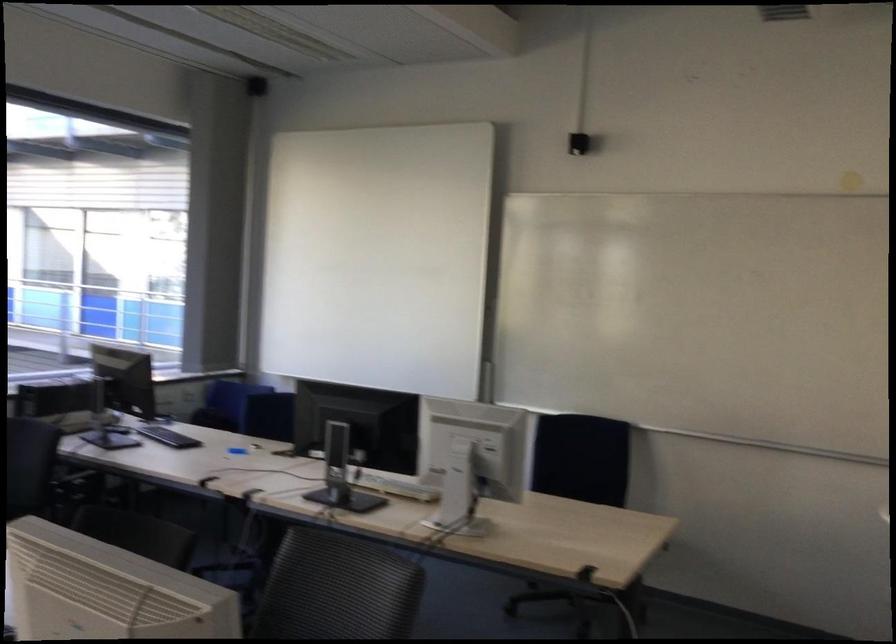
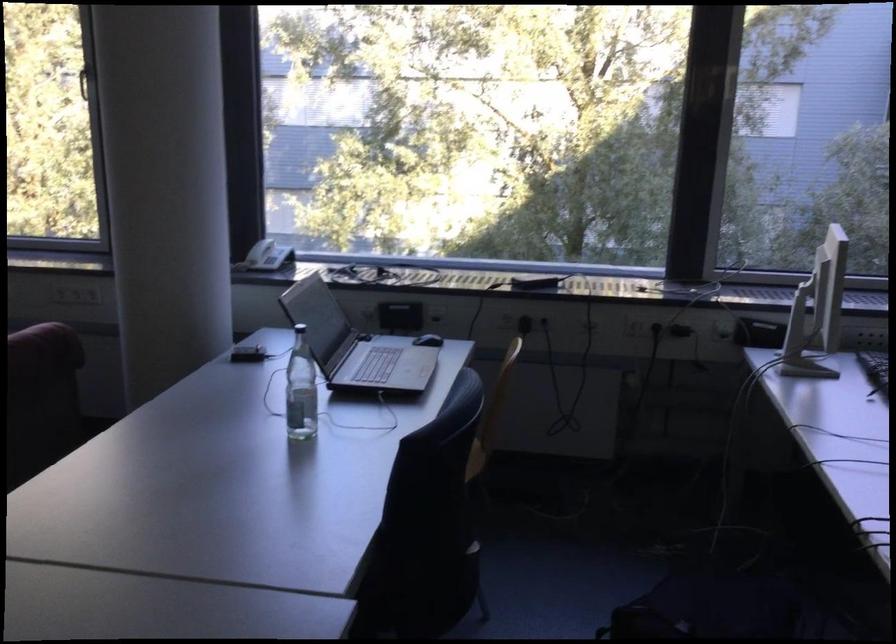
Question: How did the camera likely rotate?

Choices:
 (A) Left
 (B) Right
 (C) Up
 (D) Down

Answer: (A)